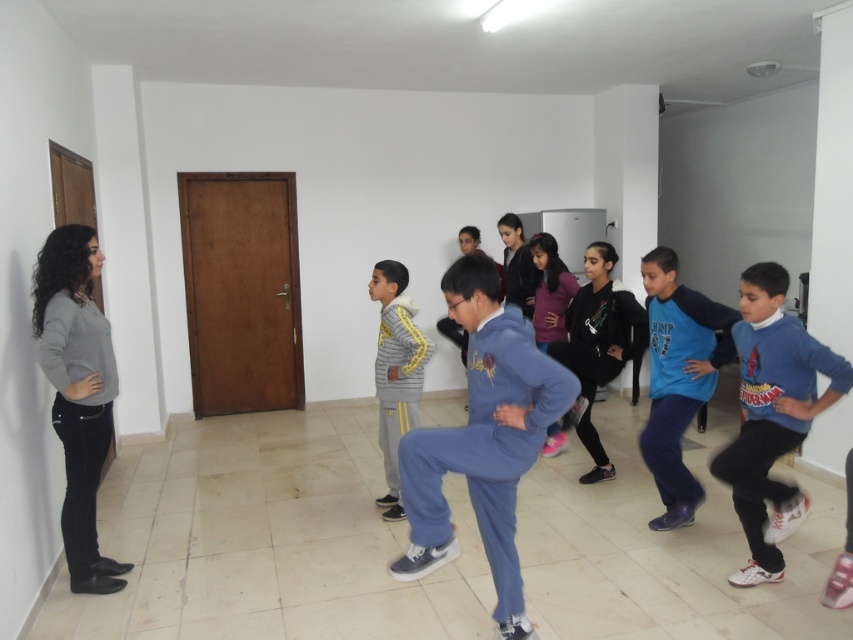
Which is in front, point (607, 372) or point (409, 368)?

Point (409, 368) is in front.

Who is more distant from viewer, (553, 356) or (393, 340)?

The point (553, 356) is behind.

Between point (608, 305) and point (392, 467), which one is positioned behind?

The point (392, 467) is behind.

I want to click on black matte sweatshirt at center, so click(x=598, y=346).

Does blue cotton sweater at right have a greater height compared to gray matte sweater at left?

Incorrect, blue cotton sweater at right's height is not larger of gray matte sweater at left's.

Who is taller, blue cotton sweater at right or gray matte sweater at left?

gray matte sweater at left

Which is in front, point (798, 518) or point (77, 492)?

Point (77, 492) is more forward.

This screenshot has height=640, width=853. Identify the location of blue cotton sweater at right. (772, 416).

Can you confirm if blue cotton sweater at right is wider than blue fleece jacket at center?

Yes, blue cotton sweater at right is wider than blue fleece jacket at center.

Between point (744, 531) and point (676, 397), which one is positioned behind?

The point (676, 397) is behind.

Describe the element at coordinates (772, 416) in the screenshot. I see `blue cotton sweater at right` at that location.

Find the location of a particular element. Image resolution: width=853 pixels, height=640 pixels. blue cotton sweater at right is located at coordinates (772, 416).